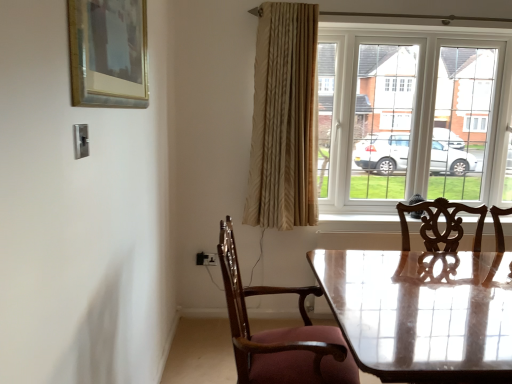
Question: From the image's perspective, is white glass window at upper right positioned above or below beige textured curtain at upper right?

Choices:
 (A) above
 (B) below

Answer: (A)

Question: Looking at their shapes, would you say white glass window at upper right is wider or thinner than beige textured curtain at upper right?

Choices:
 (A) thin
 (B) wide

Answer: (B)

Question: Which object is positioned closest to the gold-framed painting at upper left?

Choices:
 (A) glossy wooden table at center
 (B) beige textured curtain at upper right
 (C) white glass window at upper right
 (D) wooden chair with upholstered seat at lower center

Answer: (D)

Question: Estimate the real-world distances between objects in this image. Which object is farther from the beige textured curtain at upper right?

Choices:
 (A) white glass window at upper right
 (B) gold-framed painting at upper left
 (C) glossy wooden table at center
 (D) wooden chair with upholstered seat at lower center

Answer: (B)